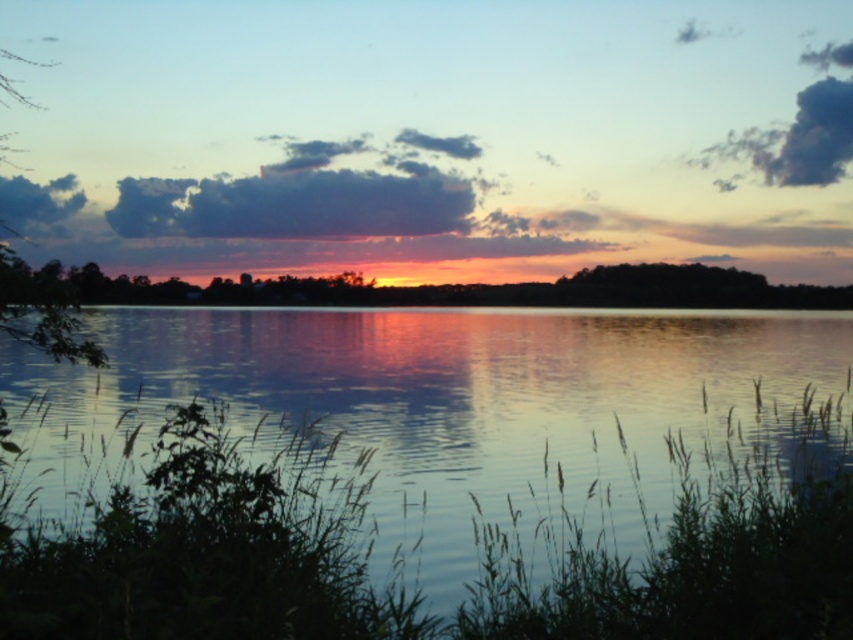
Is green leafy tree at left further to the viewer compared to dark gray cloud at upper left?

No, it is in front of dark gray cloud at upper left.

Between point (1, 305) and point (4, 200), which one is positioned in front?

Point (1, 305) is in front.

This screenshot has width=853, height=640. I want to click on green leafy tree at left, so click(41, 307).

Which of these two, blue reflective water at center or dark gray cloud at upper left, stands shorter?

dark gray cloud at upper left

Who is higher up, blue reflective water at center or dark gray cloud at upper left?

dark gray cloud at upper left is higher up.

Is point (397, 412) closer to viewer compared to point (0, 195)?

Yes, point (397, 412) is in front of point (0, 195).

The width and height of the screenshot is (853, 640). What are the coordinates of `blue reflective water at center` in the screenshot? It's located at 445,476.

In the scene shown: Can you confirm if blue reflective water at center is shorter than dark gray fluffy cloud at upper center?

Yes, blue reflective water at center is shorter than dark gray fluffy cloud at upper center.

I want to click on blue reflective water at center, so click(x=445, y=476).

Is point (828, 316) in front of point (117, 208)?

Yes, point (828, 316) is closer to viewer.

This screenshot has height=640, width=853. I want to click on blue reflective water at center, so click(x=445, y=476).